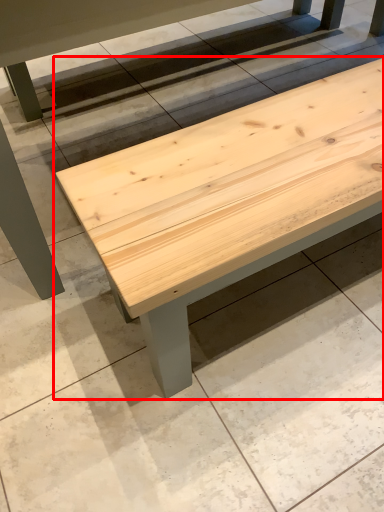
Question: Considering the relative positions of table (annotated by the red box) and concrete in the image provided, where is table (annotated by the red box) located with respect to the staircase?

Choices:
 (A) right
 (B) left

Answer: (B)